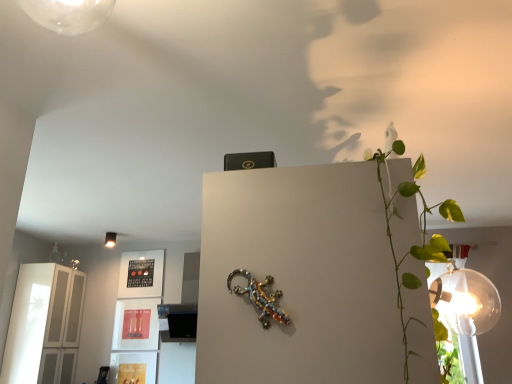
Question: Is white glossy cabinet at left closer to camera compared to matte white lampshade at upper left?

Choices:
 (A) yes
 (B) no

Answer: (A)

Question: Does white glossy cabinet at left have a lesser width compared to matte white lampshade at upper left?

Choices:
 (A) no
 (B) yes

Answer: (A)

Question: Is white glossy cabinet at left not near matte white lampshade at upper left?

Choices:
 (A) yes
 (B) no

Answer: (A)

Question: Is white glossy cabinet at left taller than matte white lampshade at upper left?

Choices:
 (A) yes
 (B) no

Answer: (A)

Question: From the image's perspective, is white glossy cabinet at left on matte white lampshade at upper left?

Choices:
 (A) yes
 (B) no

Answer: (B)

Question: Does white glossy cabinet at left have a smaller size compared to matte white lampshade at upper left?

Choices:
 (A) no
 (B) yes

Answer: (A)

Question: Is matte white lampshade at upper left outside white glossy cabinet at left?

Choices:
 (A) no
 (B) yes

Answer: (B)

Question: Is matte white lampshade at upper left aimed at white glossy cabinet at left?

Choices:
 (A) no
 (B) yes

Answer: (A)

Question: Are matte white lampshade at upper left and white glossy cabinet at left beside each other?

Choices:
 (A) no
 (B) yes

Answer: (A)

Question: Can you confirm if matte white lampshade at upper left is bigger than white glossy cabinet at left?

Choices:
 (A) yes
 (B) no

Answer: (B)

Question: Does matte white lampshade at upper left have a greater height compared to white glossy cabinet at left?

Choices:
 (A) no
 (B) yes

Answer: (A)

Question: Would you say matte white lampshade at upper left contains white glossy cabinet at left?

Choices:
 (A) yes
 (B) no

Answer: (B)

Question: Can you confirm if metallic beaded lizard at center is thinner than white glossy cabinet at left?

Choices:
 (A) no
 (B) yes

Answer: (B)